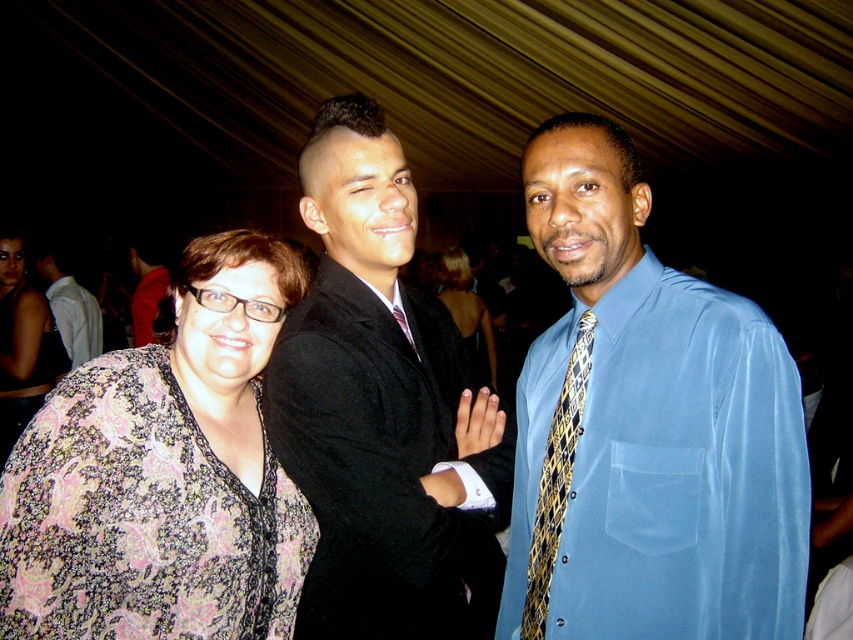
Question: Can you confirm if paisley-patterned blouse at center-left is positioned to the left of matte black suit at center?

Choices:
 (A) no
 (B) yes

Answer: (A)

Question: Which point is closer to the camera?

Choices:
 (A) shiny black suit at center
 (B) white shirt at left
 (C) gold and navy patterned tie at right
 (D) paisley-patterned blouse at center-left

Answer: (D)

Question: Considering the relative positions of gold and navy patterned tie at right and white shirt at left in the image provided, where is gold and navy patterned tie at right located with respect to white shirt at left?

Choices:
 (A) above
 (B) below

Answer: (B)

Question: From the image, what is the correct spatial relationship of paisley-patterned blouse at center-left in relation to floral-patterned blouse at center-left?

Choices:
 (A) left
 (B) right

Answer: (B)

Question: Among these objects, which one is nearest to the camera?

Choices:
 (A) paisley-patterned blouse at center-left
 (B) white shirt at left

Answer: (A)

Question: Which object is the farthest from the blue satin shirt at center?

Choices:
 (A) shiny black dress at center
 (B) white shirt at left
 (C) matte black suit at center
 (D) paisley-patterned blouse at center-left

Answer: (A)